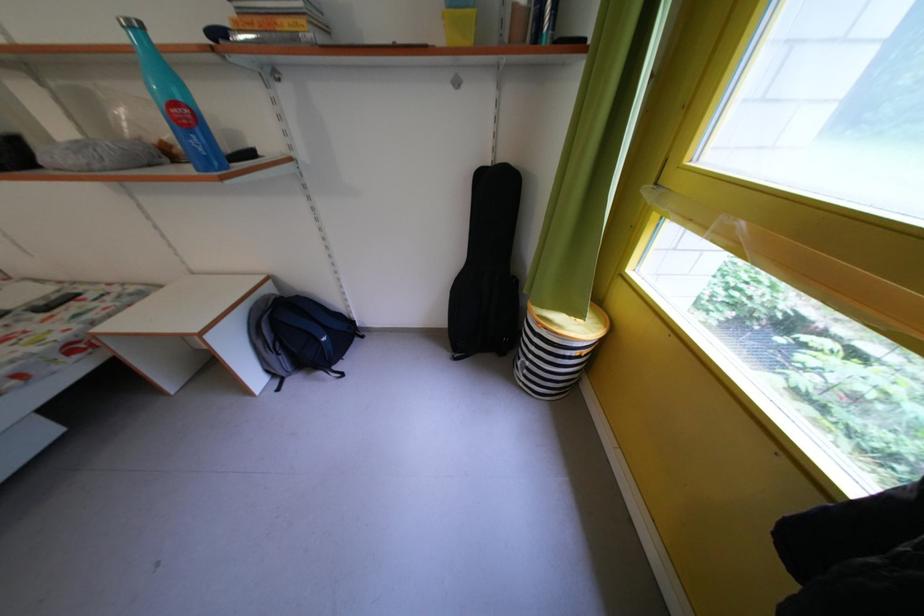
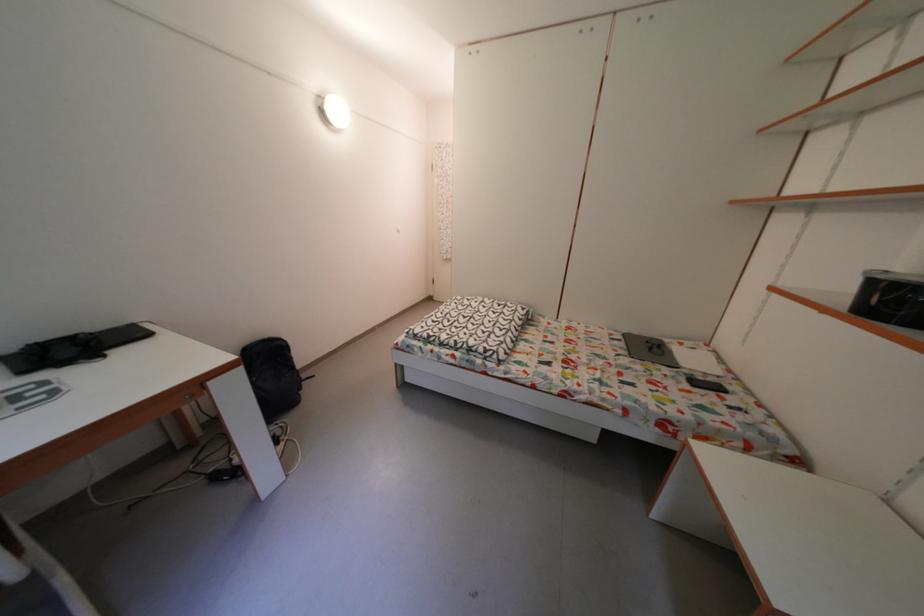
Locate, in the second image, the point that corresponds to the point at 65,302 in the first image.

(721, 385)